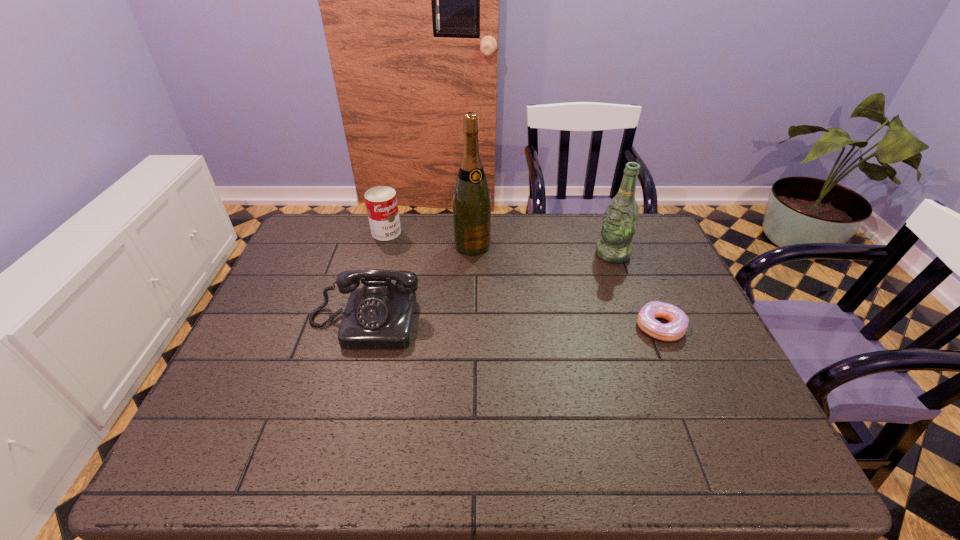
This screenshot has height=540, width=960. I want to click on telephone, so click(x=380, y=315).

Image resolution: width=960 pixels, height=540 pixels. I want to click on doughnut, so click(x=678, y=323).

Locate an element on the screen. beer bottle is located at coordinates (620, 219).

I want to click on can, so click(381, 202).

Locate an element on the screen. the tallest object is located at coordinates (471, 199).

Identify the location of the third object from left to right. (471, 199).

Where is `free space located on the dial of the telephone`? The height and width of the screenshot is (540, 960). free space located on the dial of the telephone is located at coordinates (348, 381).

Identify the location of vacant region located 0.140m on the back of the shortest object. The image size is (960, 540). pos(639,276).

The image size is (960, 540). Find the location of `vacant region located 0.340m on the surface of the beer bottle`. vacant region located 0.340m on the surface of the beer bottle is located at coordinates (518, 310).

Where is `free spot located on the surface of the beer bottle`? This screenshot has width=960, height=540. free spot located on the surface of the beer bottle is located at coordinates (545, 295).